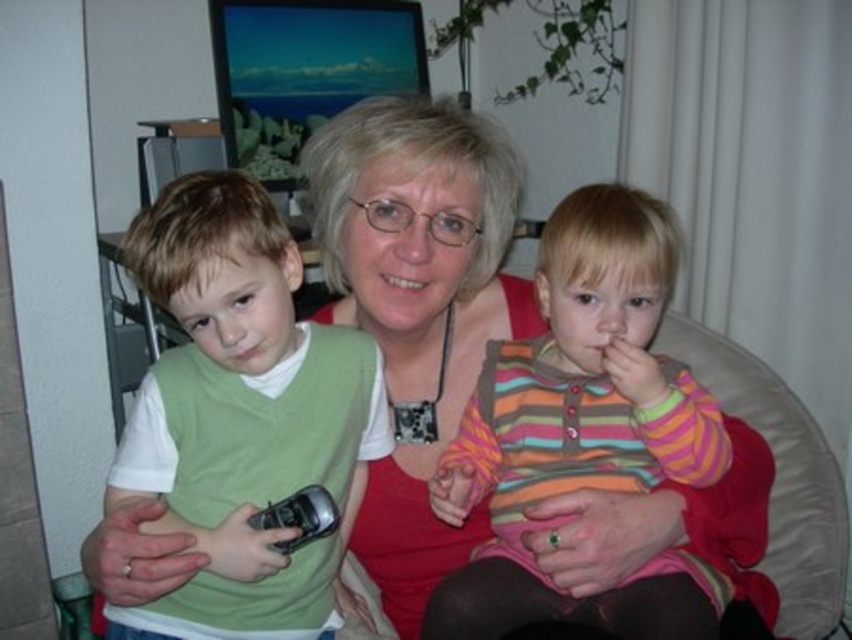
Who is more distant from viewer, (551, 337) or (246, 598)?

Point (551, 337)

The height and width of the screenshot is (640, 852). What are the coordinates of `striped cotton shirt at center` in the screenshot? It's located at (582, 428).